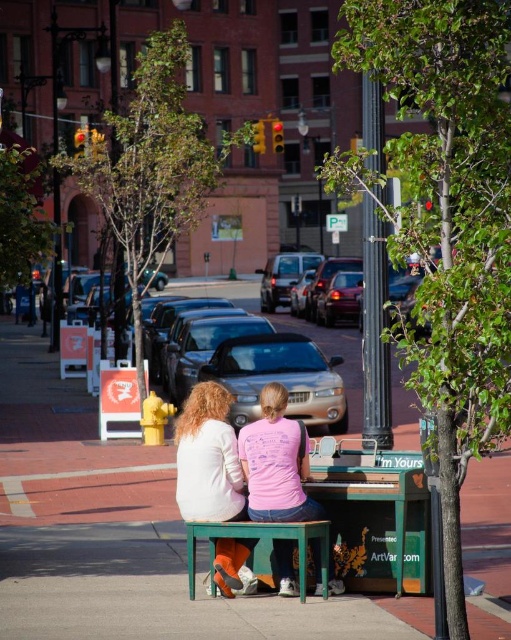
Question: Does green wooden bench at center lie in front of green leafy tree at upper center?

Choices:
 (A) yes
 (B) no

Answer: (A)

Question: Is green matte piano at center in front of green painted wood table at center?

Choices:
 (A) yes
 (B) no

Answer: (B)

Question: Which object is closer to the camera taking this photo?

Choices:
 (A) green matte piano at center
 (B) matte pink shirt at center
 (C) green painted wood table at center

Answer: (C)

Question: Which point is closer to the camera?

Choices:
 (A) green painted wood table at center
 (B) green matte piano at center

Answer: (A)

Question: Which point is farther to the camera?

Choices:
 (A) green leafy tree at upper center
 (B) green leafy tree at center
 (C) green wooden bench at center

Answer: (A)

Question: In this image, where is green wooden bench at center located relative to green leafy tree at center?

Choices:
 (A) above
 (B) below

Answer: (B)